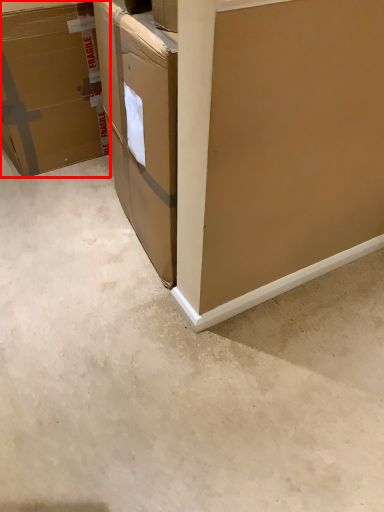
Question: From the image's perspective, what is the correct spatial relationship of box (annotated by the red box) in relation to concrete?

Choices:
 (A) below
 (B) above

Answer: (B)